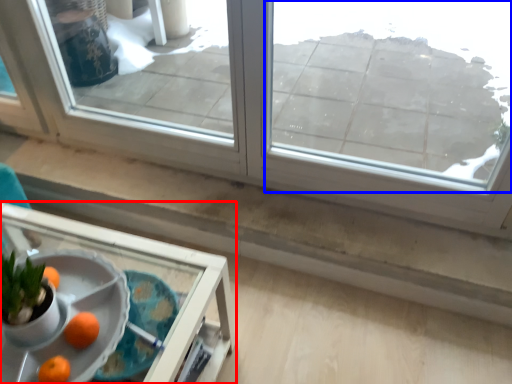
Question: Which of the following is the closest to the observer, table (highlighted by a red box) or window (highlighted by a blue box)?

Choices:
 (A) table
 (B) window

Answer: (A)